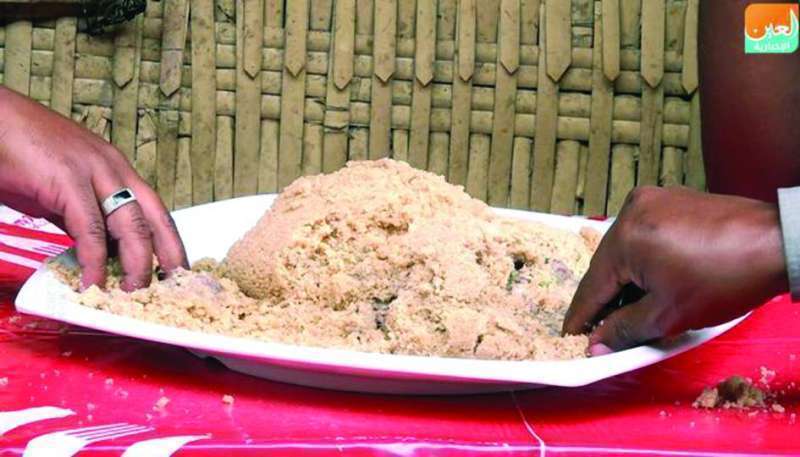
At what (x,y) coordinates should I click in order to perform the action: click on plate. Please return your answer as a coordinate pair (x, y). Looking at the image, I should click on pos(388,367).